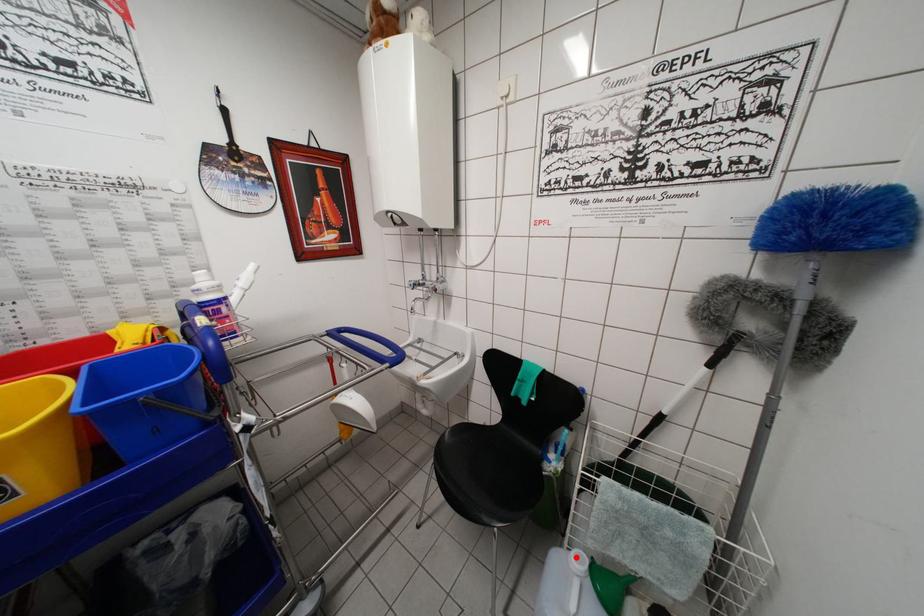
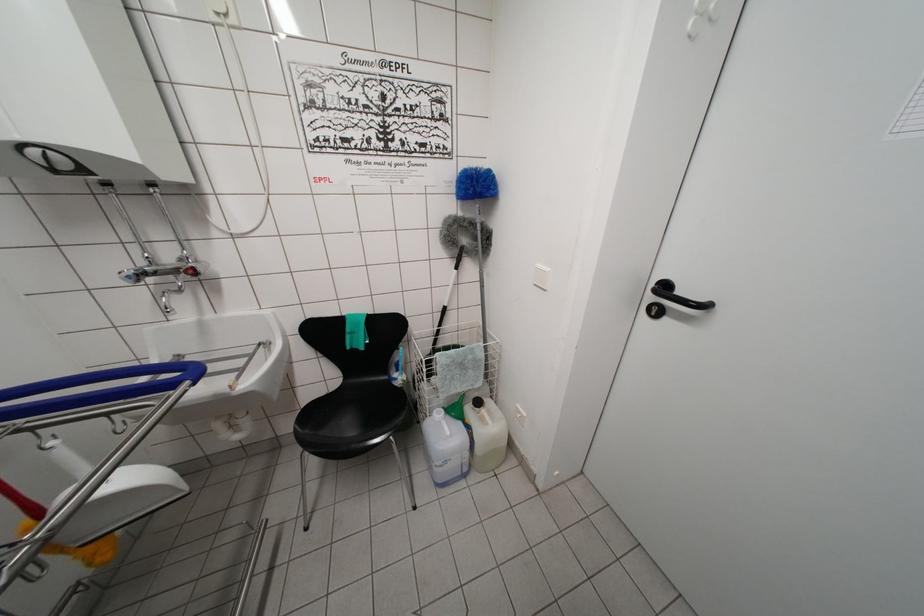
Find the pixel in the second image that matches the highlighted location in the first image.

(438, 418)